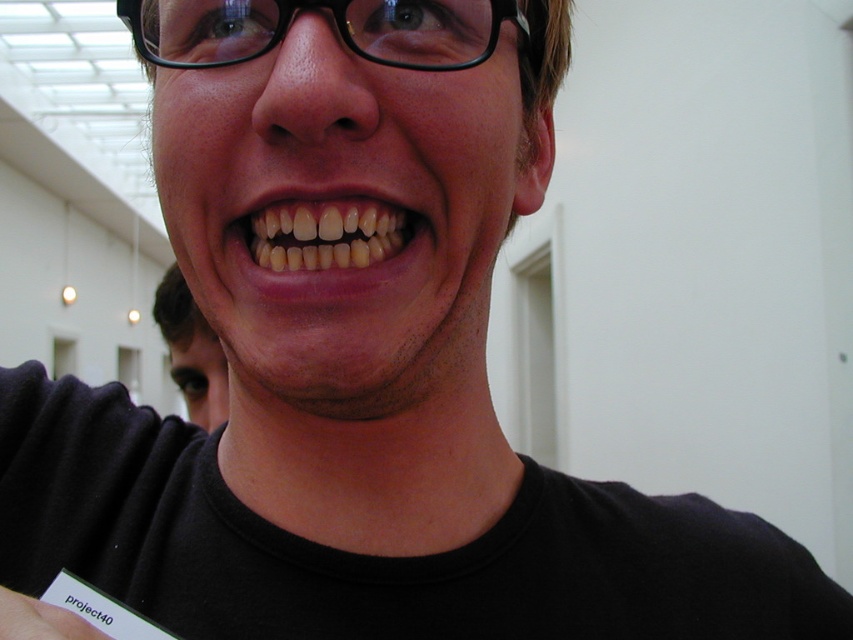
Between natural yellow teeth at center and white paper at lower left, which one is positioned higher?

natural yellow teeth at center

Is natural yellow teeth at center to the left of white paper at lower left from the viewer's perspective?

No, natural yellow teeth at center is not to the left of white paper at lower left.

What do you see at coordinates (325, 243) in the screenshot?
I see `natural yellow teeth at center` at bounding box center [325, 243].

Locate an element on the screen. natural yellow teeth at center is located at coordinates coord(325,243).

Who is taller, natural yellow teeth at center or matte black shirt at lower left?

matte black shirt at lower left

Which is in front, point (335, 273) or point (186, 326)?

Point (335, 273)

Image resolution: width=853 pixels, height=640 pixels. Identify the location of natural yellow teeth at center. (325, 243).

Does matte black shirt at lower left have a lesser width compared to white paper at lower left?

In fact, matte black shirt at lower left might be wider than white paper at lower left.

Is matte black shirt at lower left to the left of white paper at lower left from the viewer's perspective?

Correct, you'll find matte black shirt at lower left to the left of white paper at lower left.

What are the coordinates of `matte black shirt at lower left` in the screenshot? It's located at (190, 352).

I want to click on matte black shirt at lower left, so click(x=190, y=352).